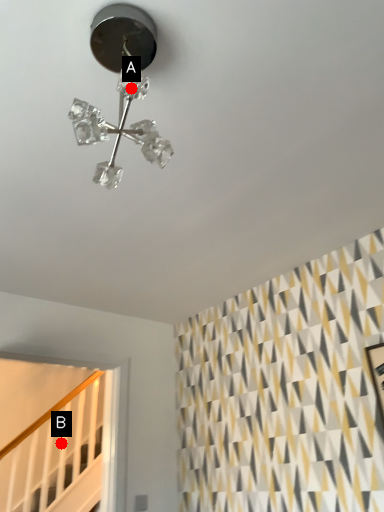
Question: Two points are circled on the image, labeled by A and B beside each circle. Which of the following is the closest to the observer?

Choices:
 (A) A is closer
 (B) B is closer

Answer: (A)